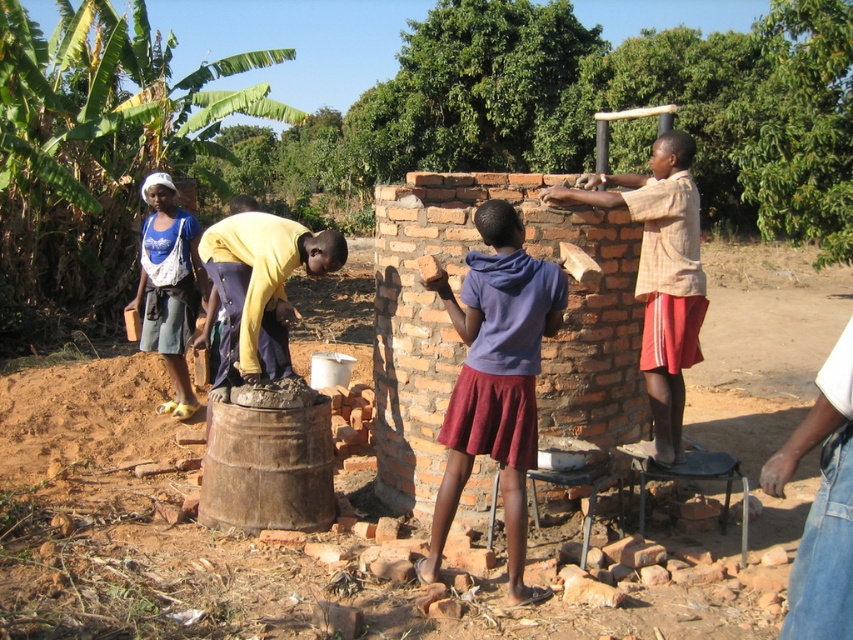
Which of these two, denim jeans at lower right or denim shorts at left, stands shorter?

denim jeans at lower right is shorter.

Does point (833, 449) lie in front of point (172, 330)?

Yes.

Image resolution: width=853 pixels, height=640 pixels. What are the coordinates of `denim jeans at lower right` in the screenshot? It's located at (821, 506).

At what (x,y) coordinates should I click in order to perform the action: click on denim jeans at lower right. Please return your answer as a coordinate pair (x, y). Image resolution: width=853 pixels, height=640 pixels. Looking at the image, I should click on (821, 506).

Does purple matte skirt at center have a smaller size compared to denim jeans at lower right?

No.

This screenshot has height=640, width=853. What do you see at coordinates (496, 380) in the screenshot?
I see `purple matte skirt at center` at bounding box center [496, 380].

Locate an element on the screen. purple matte skirt at center is located at coordinates (496, 380).

Can you confirm if purple matte skirt at center is thinner than plaid shirt at right?

Yes.

Describe the element at coordinates (496, 380) in the screenshot. I see `purple matte skirt at center` at that location.

Find the location of `purple matte skirt at center`. purple matte skirt at center is located at coordinates (496, 380).